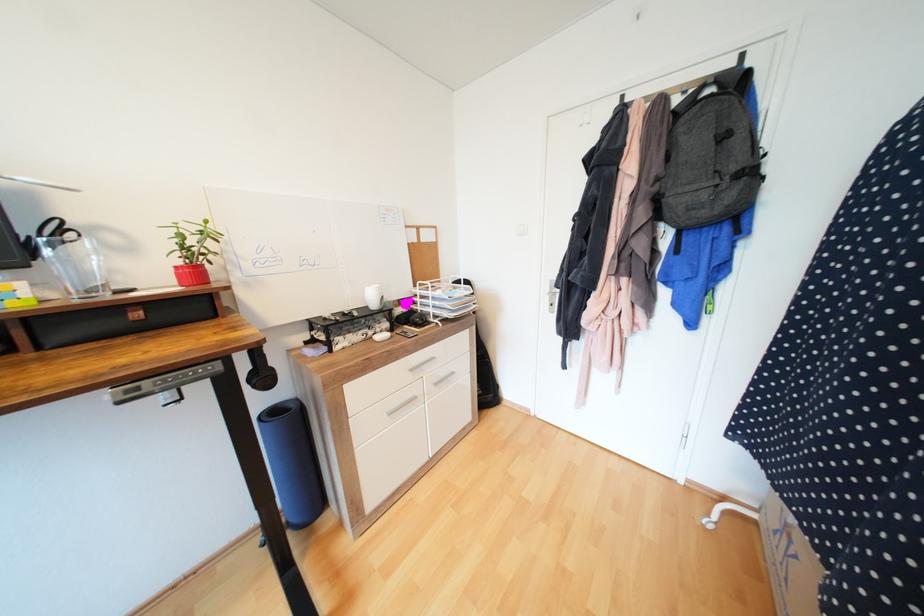
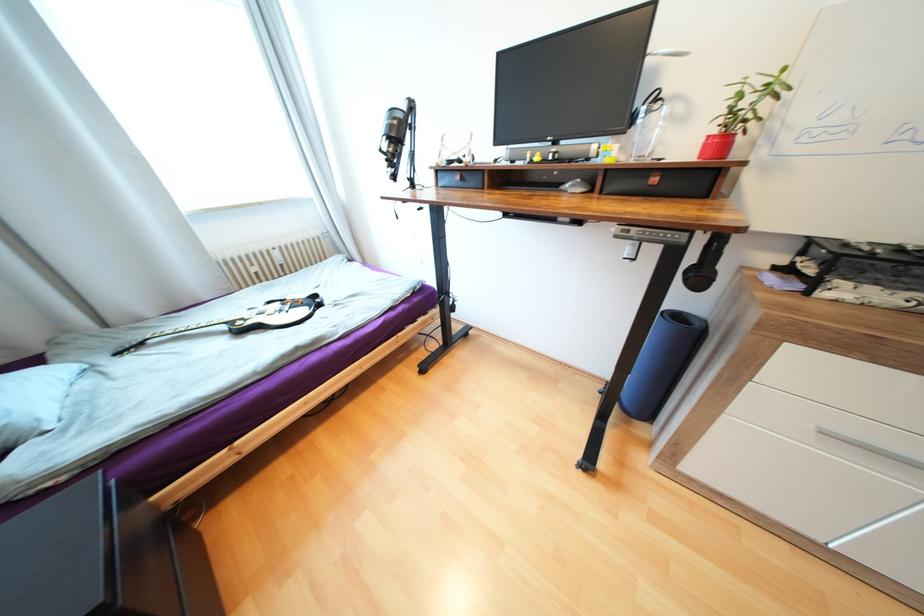
In the second image, find the point that corresponds to point (152, 384) in the first image.

(639, 230)